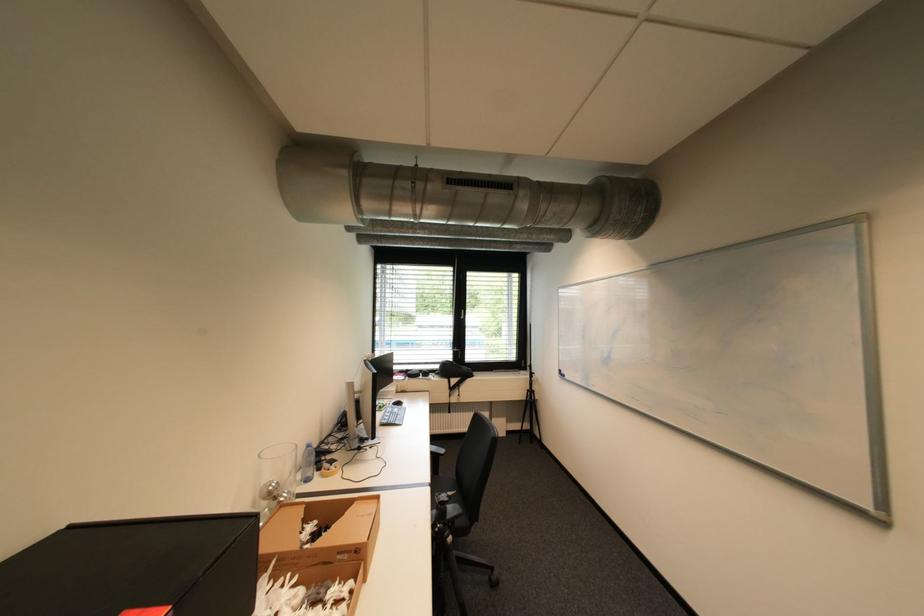
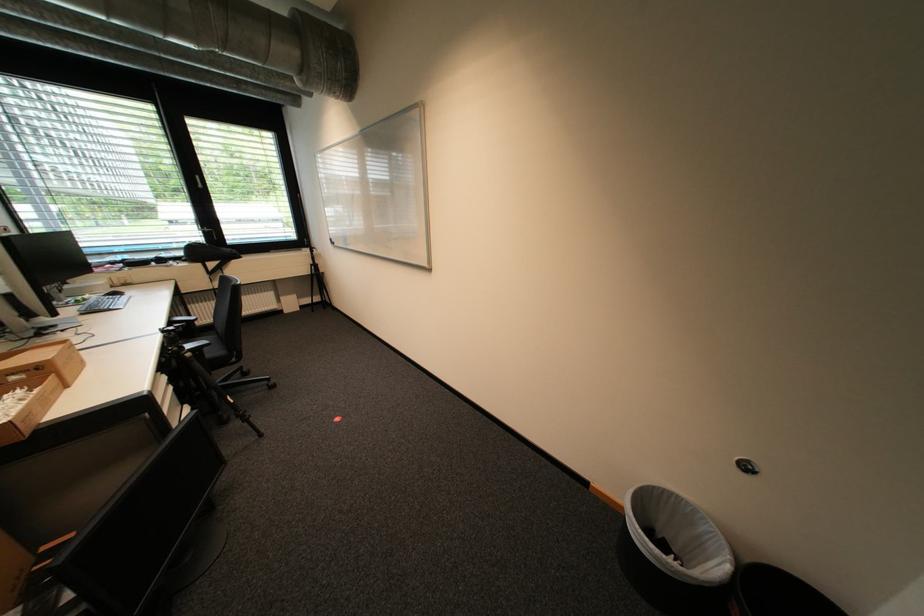
Locate, in the second image, the point that corresponds to (465,521) in the first image.

(213, 350)